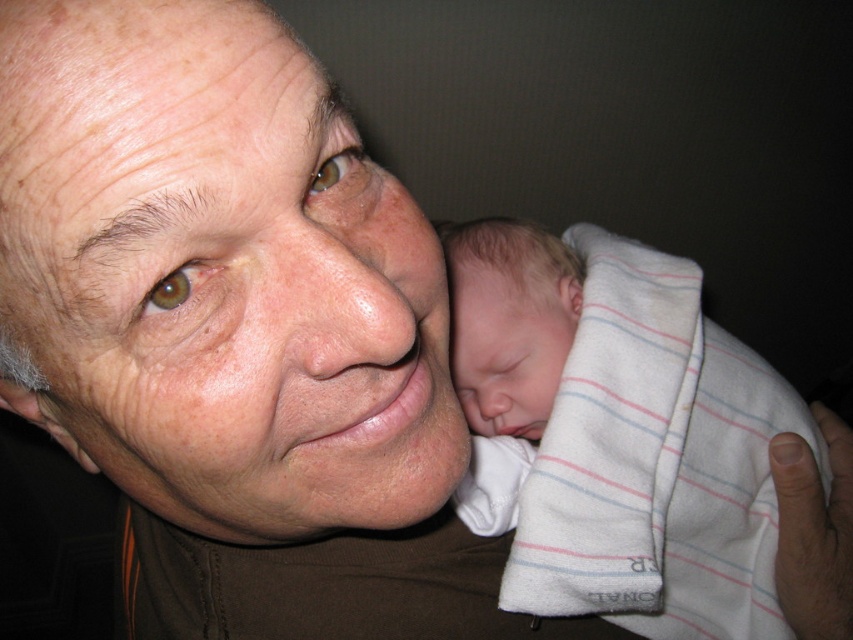
Who is shorter, smooth skin face at center or soft white blanket at right?

Standing shorter between the two is smooth skin face at center.

Is smooth skin face at center bigger than soft white blanket at right?

No.

Does point (309, 74) come behind point (654, 348)?

No, it is not.

The height and width of the screenshot is (640, 853). In order to click on smooth skin face at center in this screenshot , I will do `click(215, 275)`.